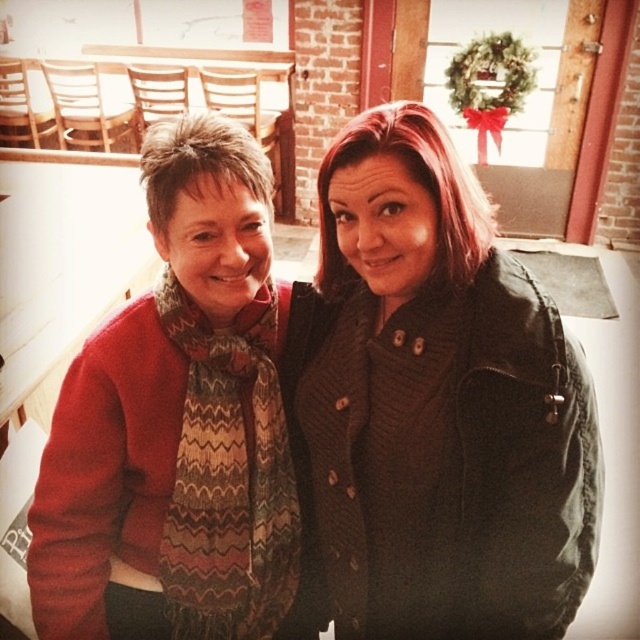
You are a photographer trying to capture a clear shot of the knitted scarf at left without the matte black jacket at center blocking it. Based on the scene, is this possible?

The matte black jacket at center is positioned over the knitted scarf at left, so it will block the view. To capture the scarf clearly, you need to adjust your angle or move the jacket temporarily.

You are a tailor who needs to determine which item requires more fabric for alterations. Based on the image, which item is larger in size between the matte black jacket at center and the knitted scarf at left?

The knitted scarf at left is larger than the matte black jacket at center, so it would require more fabric for alterations.